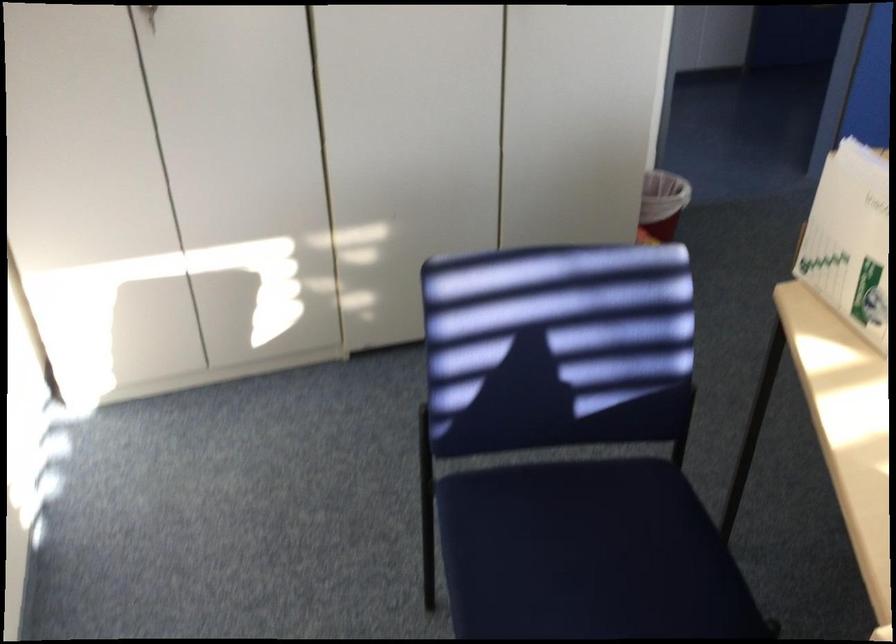
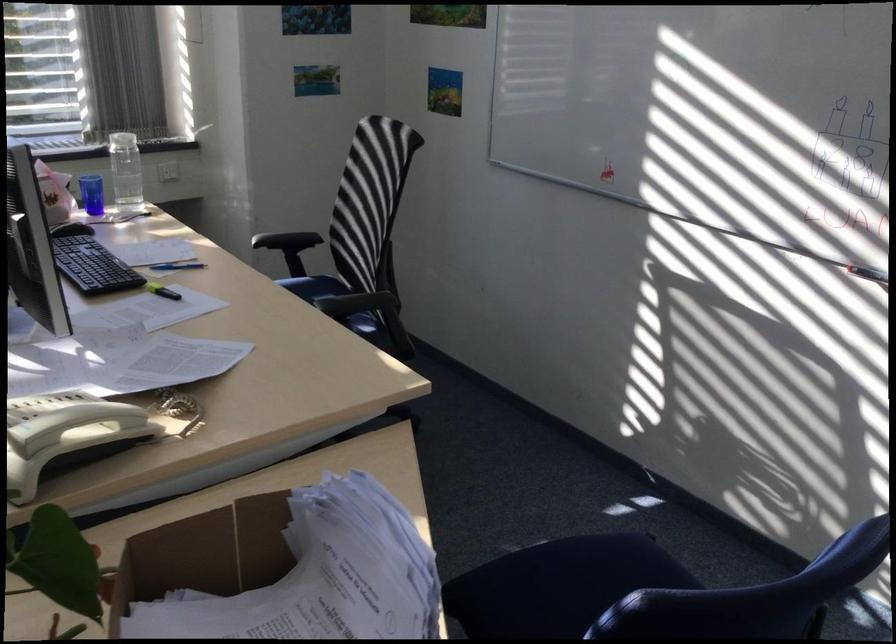
The point at (x=565, y=522) is marked in the first image. Where is the corresponding point in the second image?

(557, 585)